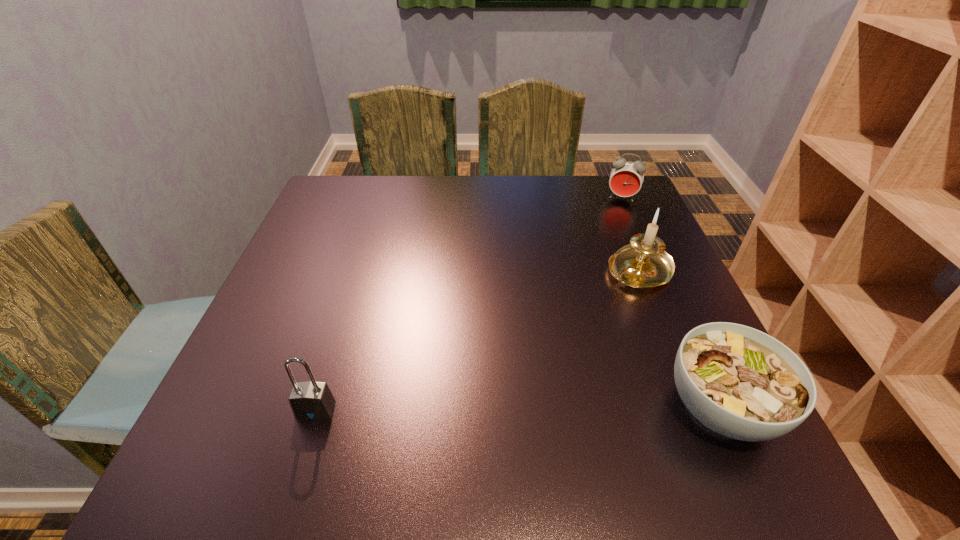
This screenshot has width=960, height=540. Find the location of `free space between the soup bowl and the leftmost object`. free space between the soup bowl and the leftmost object is located at coordinates (518, 408).

Find the location of a particular element. The height and width of the screenshot is (540, 960). free space between the alarm clock and the soup bowl is located at coordinates (671, 303).

At what (x,y) coordinates should I click in order to perform the action: click on free space that is in between the farthest object and the soup bowl. Please return your answer as a coordinate pair (x, y). This screenshot has height=540, width=960. Looking at the image, I should click on (671, 303).

Locate an element on the screen. Image resolution: width=960 pixels, height=540 pixels. free space that is in between the alarm clock and the padlock is located at coordinates (468, 304).

Find the location of `vacant area between the third nearest object and the shortest object`. vacant area between the third nearest object and the shortest object is located at coordinates (680, 339).

Find the location of a particular element. The image size is (960, 540). vacant point located between the farthest object and the second farthest object is located at coordinates (631, 234).

Where is `unoccupied area between the shortest object and the third nearest object`? This screenshot has height=540, width=960. unoccupied area between the shortest object and the third nearest object is located at coordinates pos(680,339).

The width and height of the screenshot is (960, 540). Identify the location of empty space that is in between the padlock and the shortest object. (518, 408).

The width and height of the screenshot is (960, 540). In order to click on empty space between the soup bowl and the farthest object in this screenshot , I will do `click(671, 303)`.

The width and height of the screenshot is (960, 540). In order to click on object identified as the third closest to the padlock in this screenshot , I will do `click(626, 178)`.